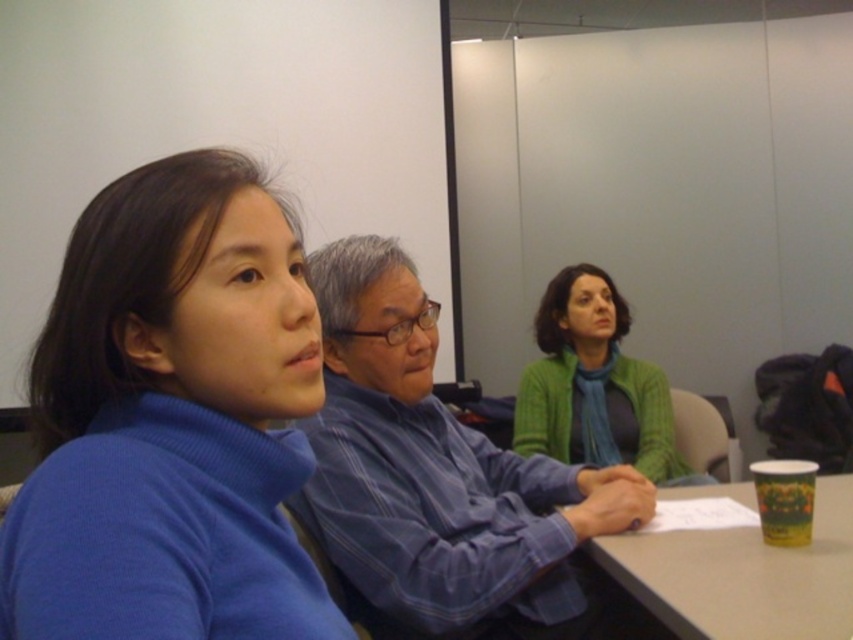
Is blue striped shirt at center behind yellow paper cup at lower right?

Yes, blue striped shirt at center is behind yellow paper cup at lower right.

Can you confirm if blue striped shirt at center is wider than yellow paper cup at lower right?

Incorrect, blue striped shirt at center's width does not surpass yellow paper cup at lower right's.

Describe the element at coordinates (439, 476) in the screenshot. Image resolution: width=853 pixels, height=640 pixels. I see `blue striped shirt at center` at that location.

At what (x,y) coordinates should I click in order to perform the action: click on blue striped shirt at center. Please return your answer as a coordinate pair (x, y). This screenshot has width=853, height=640. Looking at the image, I should click on (439, 476).

Is point (670, 566) closer to viewer compared to point (553, 282)?

That is True.

What do you see at coordinates (743, 576) in the screenshot? The width and height of the screenshot is (853, 640). I see `yellow paper cup at lower right` at bounding box center [743, 576].

Who is more forward, (732, 593) or (642, 412)?

Point (732, 593) is more forward.

The image size is (853, 640). Identify the location of yellow paper cup at lower right. (743, 576).

Can you confirm if blue striped shirt at center is positioned to the left of green knitted sweater at center?

Indeed, blue striped shirt at center is positioned on the left side of green knitted sweater at center.

Who is shorter, blue striped shirt at center or green knitted sweater at center?

green knitted sweater at center

Find the location of a particular element. The width and height of the screenshot is (853, 640). blue striped shirt at center is located at coordinates (439, 476).